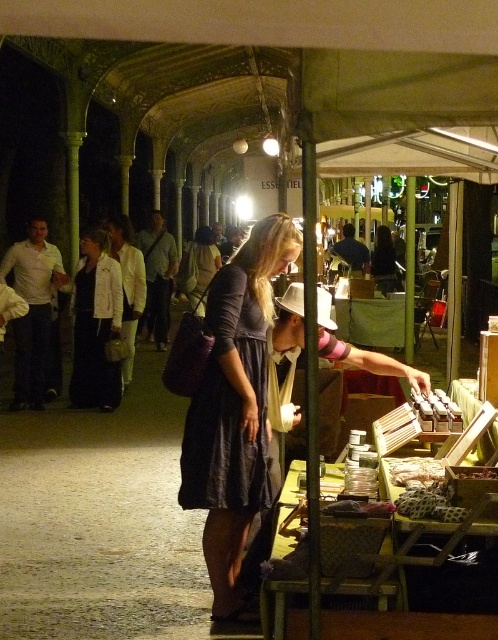
You are a customer at the market and want to try on the dark blue fabric dress at center and the matte black dress at center. Which dress should you ask the vendor to hand you first if you want to start with the one that is more accessible?

The dark blue fabric dress at center is below the matte black dress at center, so it is more accessible. You should ask the vendor to hand you the dark blue fabric dress at center first.

You are a customer at the market and want to try on the dark gray dress at center and the dark blue fabric dress at center. The fitting room is 3 inches away from both dresses. Can you reach both dresses without moving the fitting room?

The dark gray dress at center is 2.82 inches away from dark blue fabric dress at center. Since the fitting room is 3 inches away from both, the distance between the dresses is less than the fitting room distance, so you can reach both dresses without moving the fitting room.